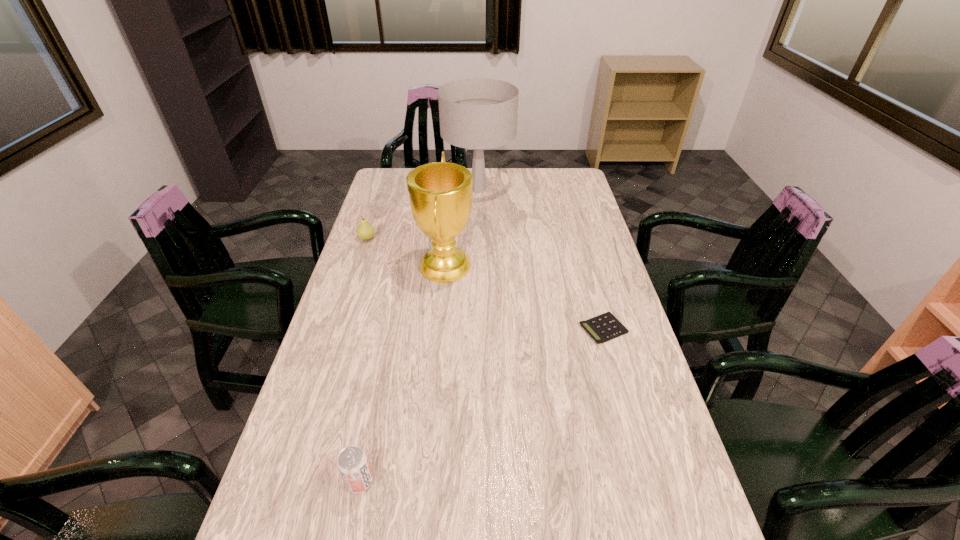
This screenshot has width=960, height=540. Identify the location of free region at the far left corner of the desktop. (389, 180).

I want to click on vacant area that lies between the nearest object and the award, so click(x=402, y=373).

At what (x,y) coordinates should I click in order to perform the action: click on free spot between the fourth shortest object and the shortest object. Please return your answer as a coordinate pair (x, y). The height and width of the screenshot is (540, 960). Looking at the image, I should click on (524, 296).

Where is `unoccupied area between the nearest object and the fourth shortest object`? This screenshot has width=960, height=540. unoccupied area between the nearest object and the fourth shortest object is located at coordinates (402, 373).

Find the location of a particular element. The height and width of the screenshot is (540, 960). vacant space that's between the second nearest object and the pear is located at coordinates (485, 284).

I want to click on unoccupied position between the soda can and the pear, so click(x=363, y=360).

You are a GUI agent. You are given a task and a screenshot of the screen. Output one action in this format:
    pyautogui.click(x=<x>, y=<y>)
    Task: Click on the free space between the fourth farthest object and the award
    The height and width of the screenshot is (540, 960).
    Given the screenshot: What is the action you would take?
    pyautogui.click(x=524, y=296)

At what (x,y) coordinates should I click in order to perform the action: click on object that is the nearest to the soda can. Please return your answer as a coordinate pair (x, y). Looking at the image, I should click on [440, 193].

Identify which object is located as the third nearest to the award. Please provide its 2D coordinates. Your answer should be formatted as a tuple, i.e. [(x, y)], where the tuple contains the x and y coordinates of a point satisfying the conditions above.

[(602, 328)]

In order to click on vacant space that satisfies the following two spatial constraints: 1. on the front-facing side of the farthest object; 2. on the left side of the calculator in this screenshot , I will do `click(478, 329)`.